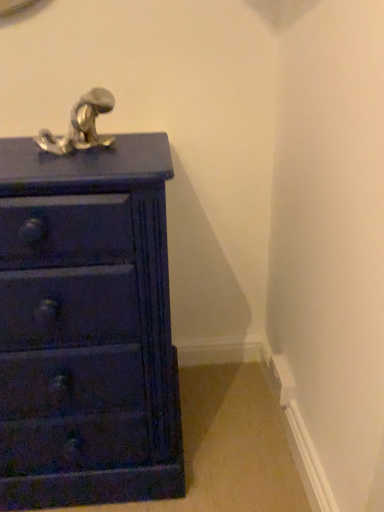
The width and height of the screenshot is (384, 512). Identify the location of vacant area that is in front of satin nickel faucet at upper left. (64, 169).